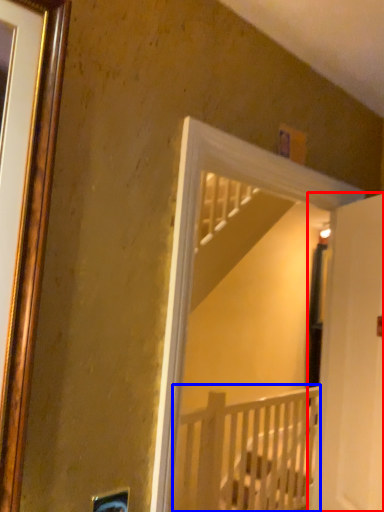
Question: Among these objects, which one is nearest to the camera, door (highlighted by a red box) or infant bed (highlighted by a blue box)?

Choices:
 (A) door
 (B) infant bed

Answer: (A)